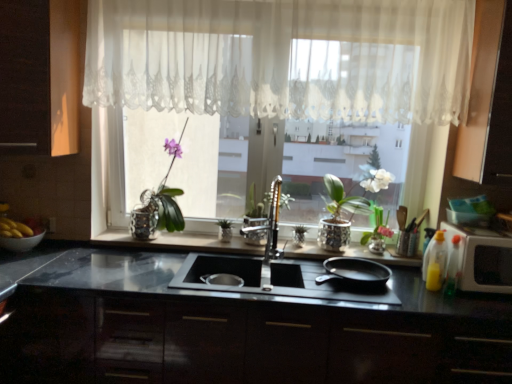
Find the location of a particular element. free spot in front of translucent plastic bottle at right, which ranks as the 1th bottle in left-to-right order is located at coordinates (455, 309).